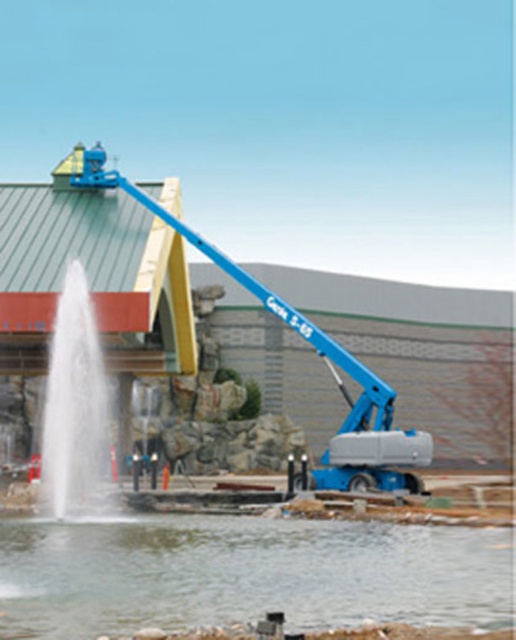
You are a maintenance worker who needs to cross from the fountain area to the building. The clear water at lower center and the blue metallic lift at center are in your path. Which path has a narrower width for you to walk through?

The clear water at lower center has a lesser width compared to blue metallic lift at center, so the path through the clear water at lower center is narrower and would require careful stepping.

You are a maintenance worker needing to access the roof of the building. The blue metallic lift at center is positioned near the fountain. Can you safely operate the lift without getting it wet from the white frothy water at center?

The white frothy water at center is located below the blue metallic lift at center, so operating the lift should be safe as the water is beneath it and unlikely to reach the lift.